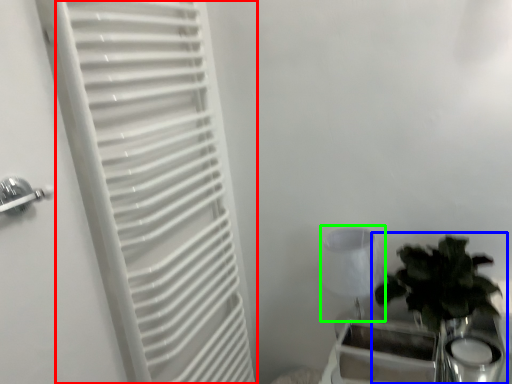
Question: Based on their relative distances, which object is farther from curtain (highlighted by a red box)? Choose from houseplant (highlighted by a blue box) and lamp (highlighted by a green box).

Choices:
 (A) houseplant
 (B) lamp

Answer: (A)